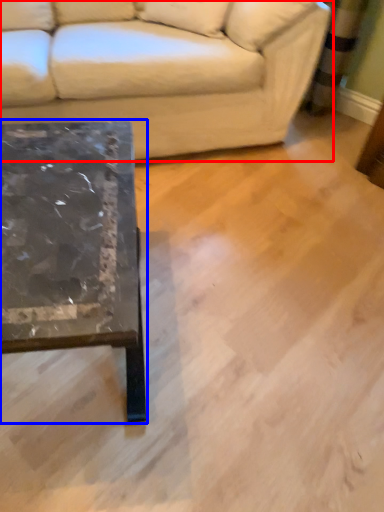
Question: Among these objects, which one is nearest to the camera, studio couch (highlighted by a red box) or coffee table (highlighted by a blue box)?

Choices:
 (A) studio couch
 (B) coffee table

Answer: (B)